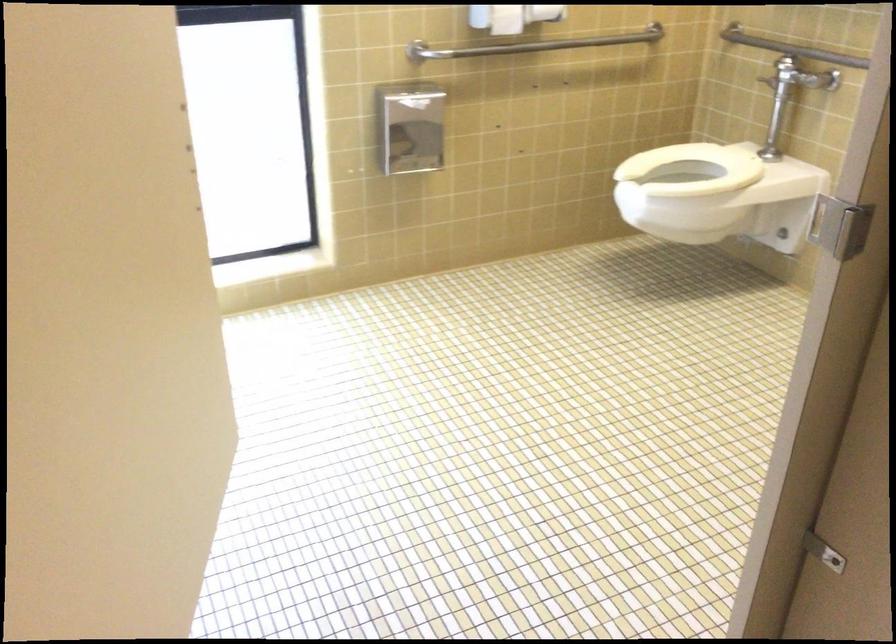
Where would you lift the white toilet seat? Please return your answer as a coordinate pair (x, y).

(692, 169)